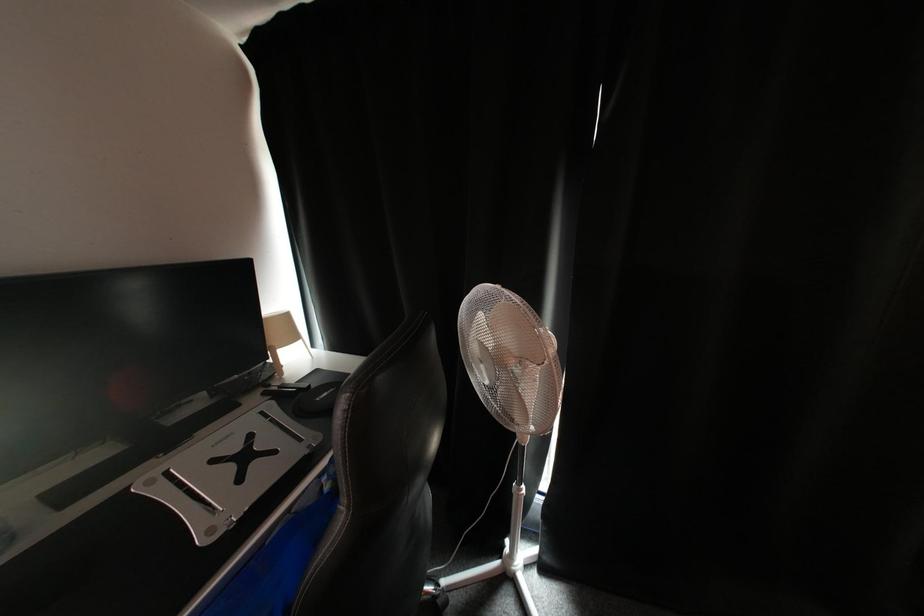
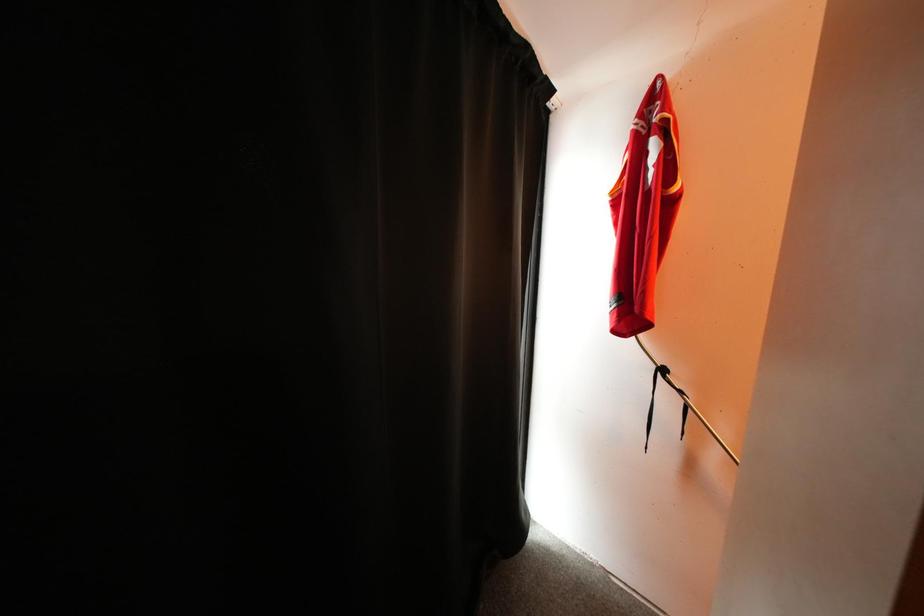
Question: The first image is from the beginning of the video and the second image is from the end. How did the camera likely rotate when shooting the video?

Choices:
 (A) Left
 (B) Right
 (C) Up
 (D) Down

Answer: (B)